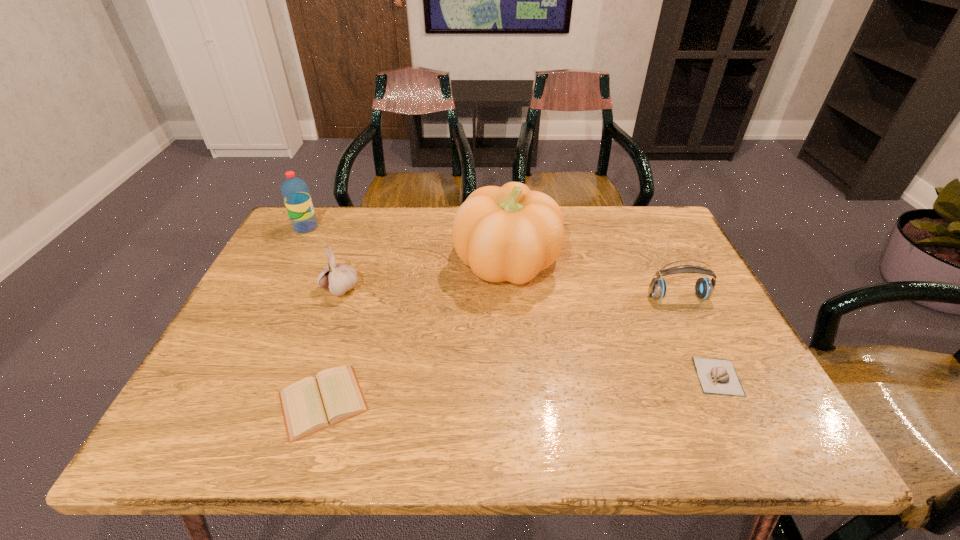
Where is `vacant space that is in between the right garlic and the diary`? The height and width of the screenshot is (540, 960). vacant space that is in between the right garlic and the diary is located at coordinates (520, 389).

Identify the location of empty location between the nearer garlic and the headset. (698, 336).

Identify the location of vacant space that's between the diary and the fourth object from left to right. The width and height of the screenshot is (960, 540). (415, 332).

Locate an element on the screen. The width and height of the screenshot is (960, 540). free space between the tallest object and the water bottle is located at coordinates (406, 245).

I want to click on vacant space that is in between the headset and the taller garlic, so click(x=509, y=293).

The width and height of the screenshot is (960, 540). In order to click on free space between the fourth object from left to right and the headset in this screenshot , I will do `click(592, 279)`.

Find the location of a particular element. free space between the nearer garlic and the water bottle is located at coordinates (512, 302).

Find the location of a particular element. This screenshot has width=960, height=540. free space between the water bottle and the fourth object from left to right is located at coordinates (406, 245).

What are the coordinates of `free space between the water bottle and the nearer garlic` in the screenshot? It's located at (512, 302).

Locate an element on the screen. free space between the pumpkin and the diary is located at coordinates (415, 332).